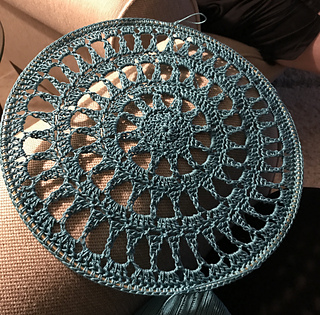
Locate an element on the screen. This screenshot has width=320, height=315. couch is located at coordinates (78, 17).